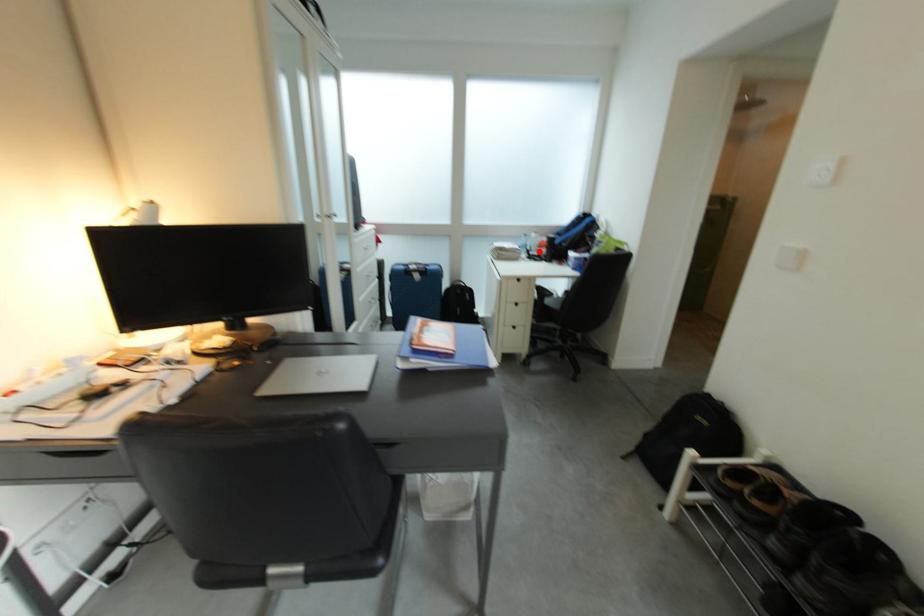
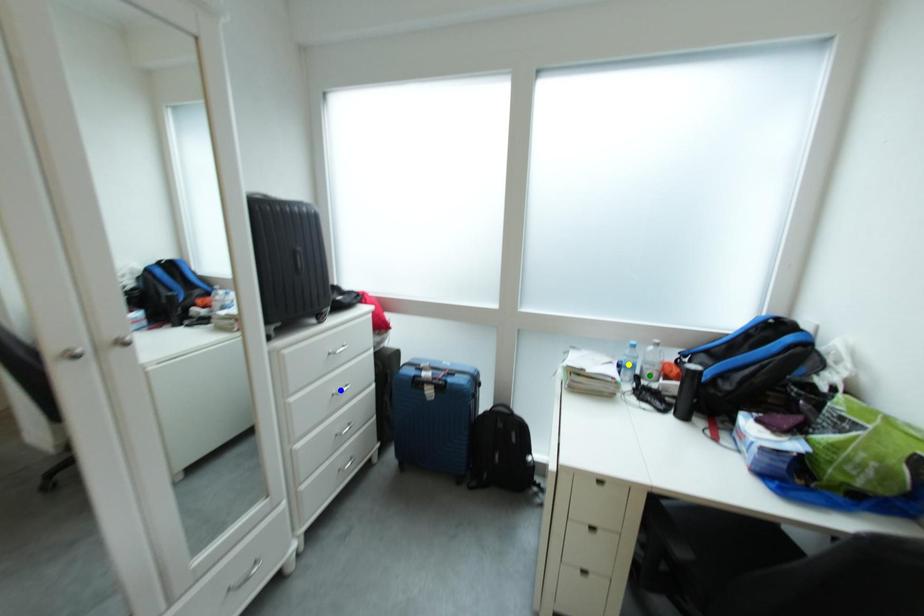
Question: I am providing you with two images of the same scene from different viewpoints. A red point is marked on the first image. You are given multiple points on the second image. Which spot in image 2 lines up with the point in image 1?

Choices:
 (A) yellow point
 (B) blue point
 (C) green point

Answer: (C)